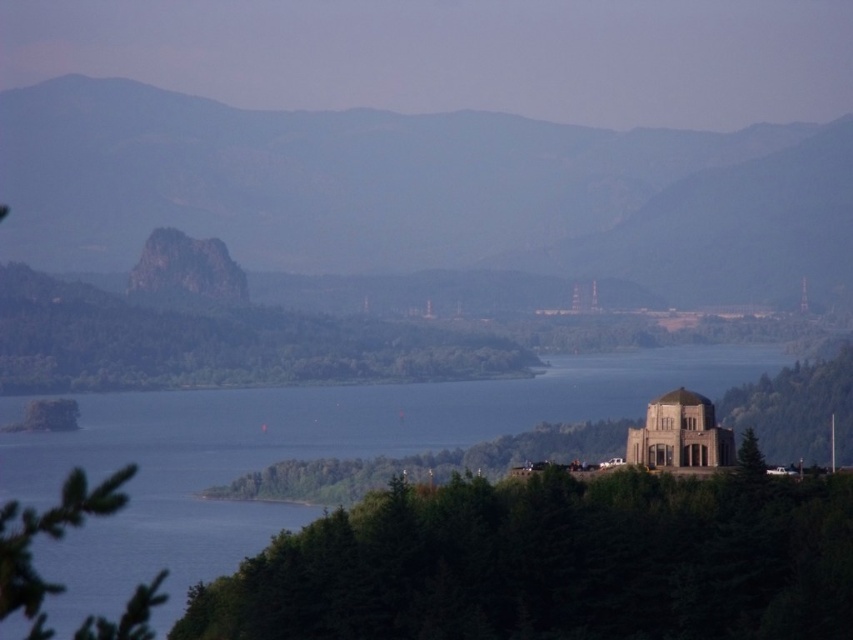
In the scene shown: You are a hiker who wants to reach the rugged granite rock at center. You are currently standing at point (424, 193). Is the point you are currently at on the rugged granite rock at center?

Yes, the point (424, 193) is on the rugged granite rock at center, so you are currently standing on it.

You are standing at the base of the hill where the historic building is located. You see the rugged granite rock at center and the blue water at center. Which object is higher in elevation?

The rugged granite rock at center is located above the blue water at center, so it has a higher elevation.

You are standing at the edge of the water in the scenic landscape and want to reach the rugged granite rock at center. Given that the water is 2000 feet wide, can you safely cross the water to get to the rock?

The distance between you and the rugged granite rock at center is 2129.97 feet, which is wider than the 2000 feet width of the water. Therefore, you cannot safely cross the water to reach the rugged granite rock at center.